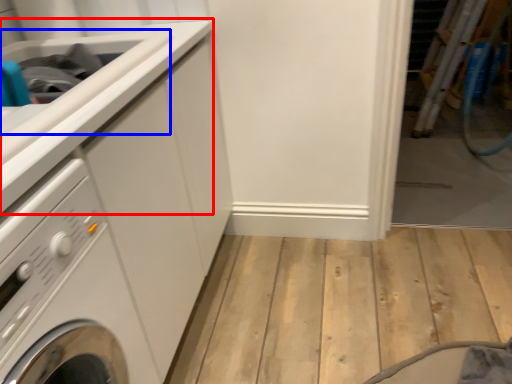
Question: Which object appears farthest to the camera in this image, counter top (highlighted by a red box) or sink (highlighted by a blue box)?

Choices:
 (A) counter top
 (B) sink

Answer: (B)